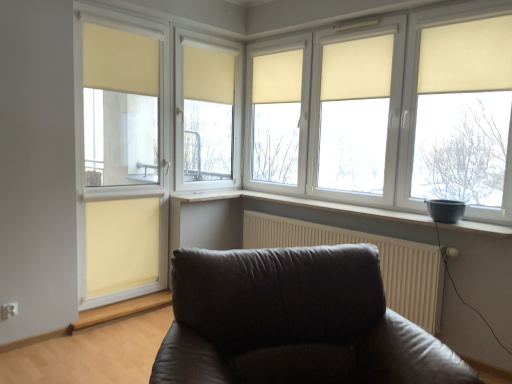
Question: From the image's perspective, is white matte window sill at center positioned above or below beige fabric curtain at lower left, the 6th curtain when ordered from right to left?

Choices:
 (A) above
 (B) below

Answer: (A)

Question: Based on their positions, is white matte window sill at center located to the left or right of beige fabric curtain at lower left, arranged as the 1th curtain when viewed from the left?

Choices:
 (A) left
 (B) right

Answer: (B)

Question: Estimate the real-world distances between objects in this image. Which object is farther from the beige fabric curtain at center, acting as the 4th curtain starting from the left?

Choices:
 (A) white plastic window at upper right
 (B) beige fabric curtain at center, which is counted as the third curtain, starting from the left
 (C) white textured radiator at lower right
 (D) beige fabric curtain at upper right, which is the sixth curtain from left to right
 (E) white matte window sill at center

Answer: (D)

Question: Estimate the real-world distances between objects in this image. Which object is farther from the white plastic window at upper right?

Choices:
 (A) beige fabric curtain at center, acting as the 4th curtain starting from the left
 (B) beige fabric curtain at upper right, which is counted as the first curtain, starting from the right
 (C) beige fabric curtain at upper left, arranged as the 5th curtain when viewed from the right
 (D) beige fabric curtain at lower left, the 6th curtain when ordered from right to left
 (E) beige fabric curtain at upper center, the 5th curtain positioned from the left

Answer: (D)